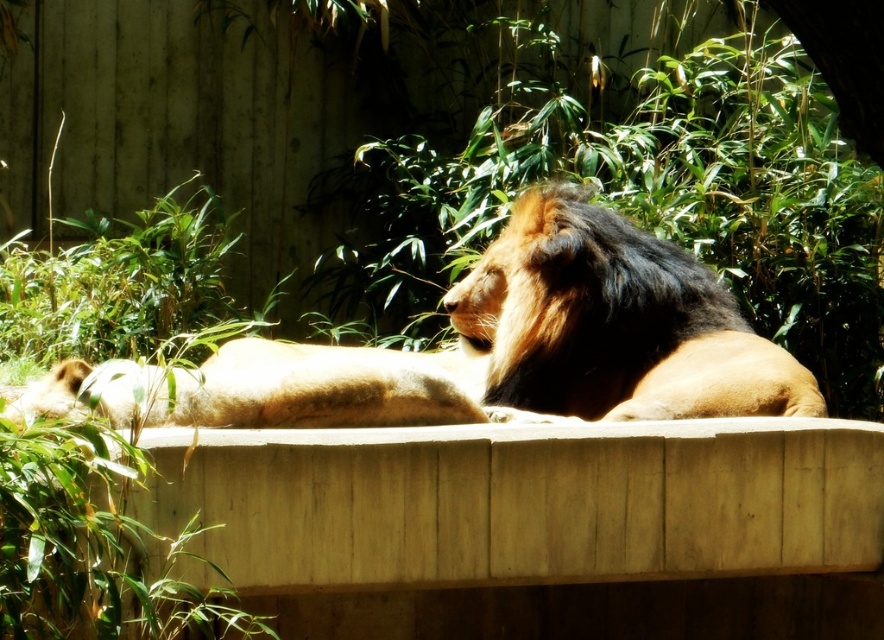
Based on the photo, is brown fur lion at center bigger than golden fur lion at center?

Indeed, brown fur lion at center has a larger size compared to golden fur lion at center.

Between point (265, 356) and point (599, 339), which one is positioned behind?

The point (599, 339) is more distant.

Does point (130, 381) come in front of point (507, 406)?

Yes, point (130, 381) is closer to viewer.

The image size is (884, 640). I want to click on brown fur lion at center, so click(x=492, y=348).